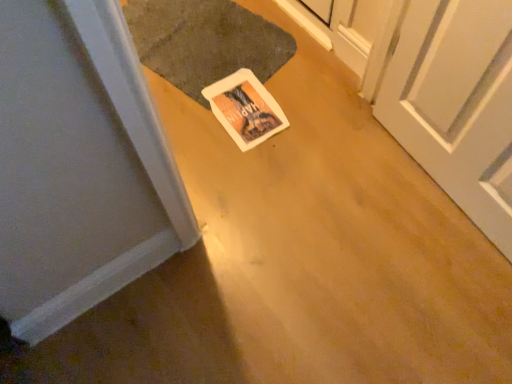
Identify the location of free point to the right of white paper postcard at center. (313, 104).